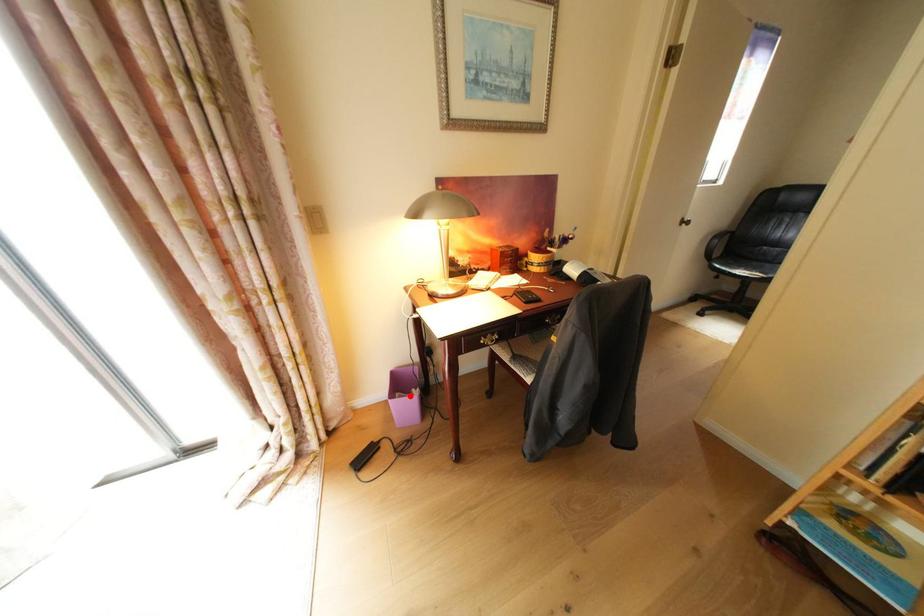
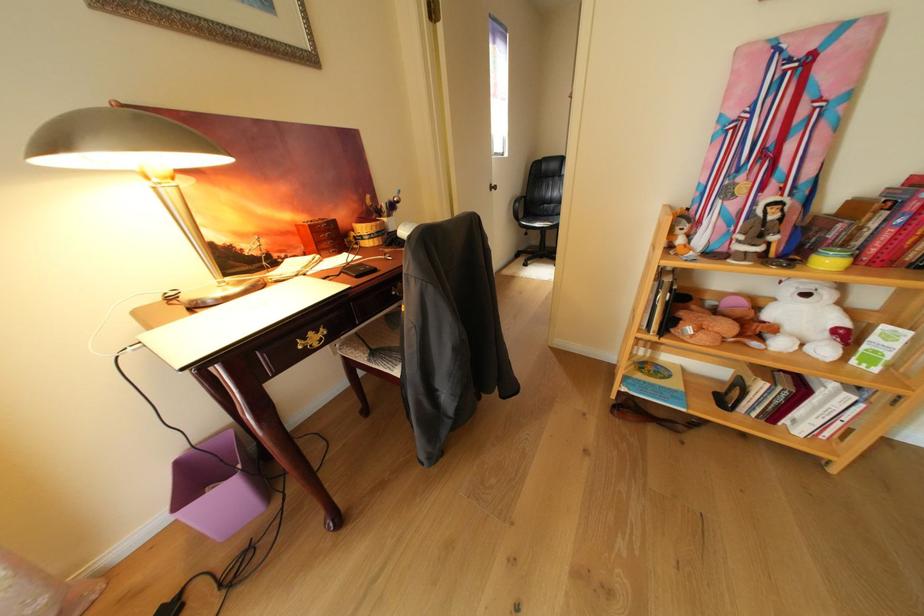
In the second image, find the point that corresponds to the highlighted location in the first image.

(221, 491)